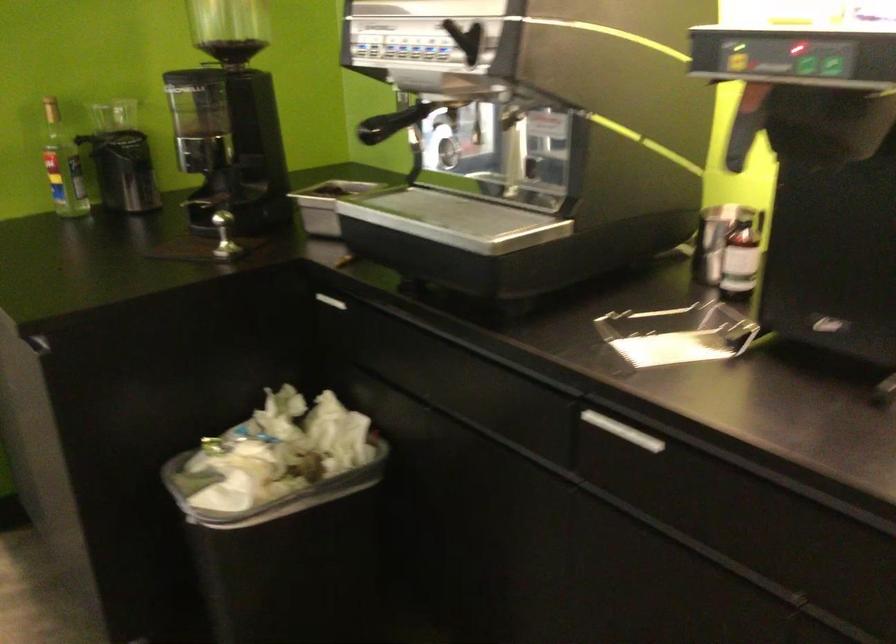
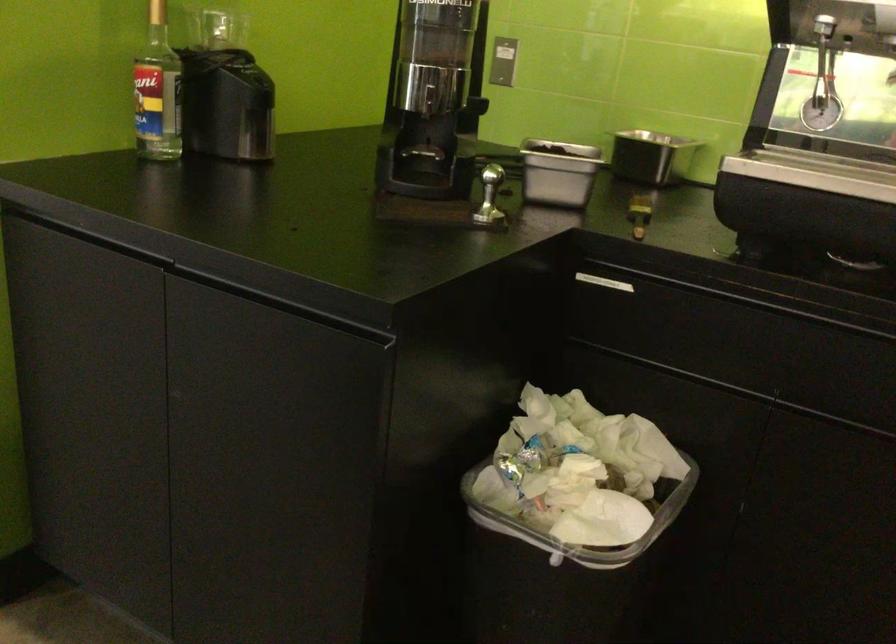
In the second image, find the point that corresponds to point 316,211 in the first image.

(558, 172)